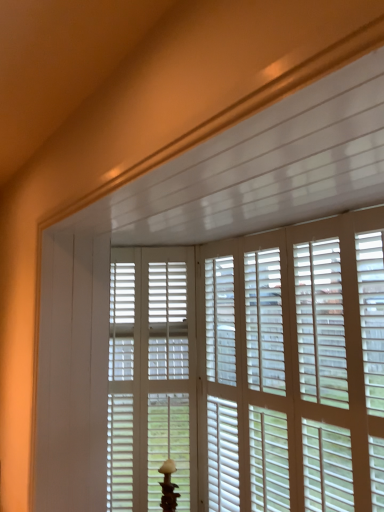
Question: Can white matte window blind at center be found inside white matte screen door at center?

Choices:
 (A) no
 (B) yes

Answer: (A)

Question: Can you confirm if white matte screen door at center is taller than white matte window blind at center?

Choices:
 (A) yes
 (B) no

Answer: (A)

Question: Does white matte screen door at center turn towards white matte window blind at center?

Choices:
 (A) no
 (B) yes

Answer: (A)

Question: Is white matte screen door at center oriented away from white matte window blind at center?

Choices:
 (A) yes
 (B) no

Answer: (B)

Question: Is white matte screen door at center thinner than white matte window blind at center?

Choices:
 (A) no
 (B) yes

Answer: (A)

Question: Would you say white matte screen door at center is inside or outside white matte window blind at center?

Choices:
 (A) inside
 (B) outside

Answer: (B)

Question: In the image, is white matte screen door at center on the left side or the right side of white matte window blind at center?

Choices:
 (A) left
 (B) right

Answer: (A)

Question: Is white matte screen door at center in front of or behind white matte window blind at center in the image?

Choices:
 (A) behind
 (B) front

Answer: (A)

Question: Is white matte screen door at center taller or shorter than white matte window blind at center?

Choices:
 (A) short
 (B) tall

Answer: (B)

Question: From a real-world perspective, is white matte table lamp at center positioned above or below white matte screen door at center?

Choices:
 (A) below
 (B) above

Answer: (A)

Question: Looking at the image, does white matte table lamp at center seem bigger or smaller compared to white matte screen door at center?

Choices:
 (A) big
 (B) small

Answer: (B)

Question: From the image's perspective, is white matte table lamp at center above or below white matte screen door at center?

Choices:
 (A) above
 (B) below

Answer: (B)

Question: Based on their positions, is white matte table lamp at center located to the left or right of white matte screen door at center?

Choices:
 (A) right
 (B) left

Answer: (A)

Question: From the image's perspective, is white matte screen door at center located above or below white matte table lamp at center?

Choices:
 (A) above
 (B) below

Answer: (A)

Question: Based on their sizes in the image, would you say white matte screen door at center is bigger or smaller than white matte table lamp at center?

Choices:
 (A) small
 (B) big

Answer: (B)